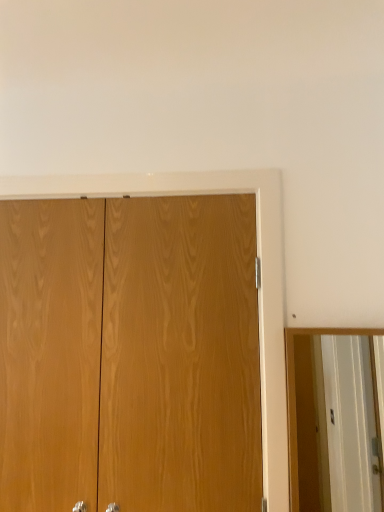
At what (x,y) coordinates should I click in order to perform the action: click on wooden door at center. Please return your answer as a coordinate pair (x, y). The height and width of the screenshot is (512, 384). Looking at the image, I should click on (129, 355).

In order to face wooden door at center, should I rotate leftwards or rightwards?

Turn left approximately 8.158 degrees to face it.

What do you see at coordinates (129, 355) in the screenshot?
I see `wooden door at center` at bounding box center [129, 355].

Measure the distance between wooden door at center and camera.

They are 1.32 meters apart.

Find the location of a particular element. The width and height of the screenshot is (384, 512). wooden door at center is located at coordinates pyautogui.click(x=129, y=355).